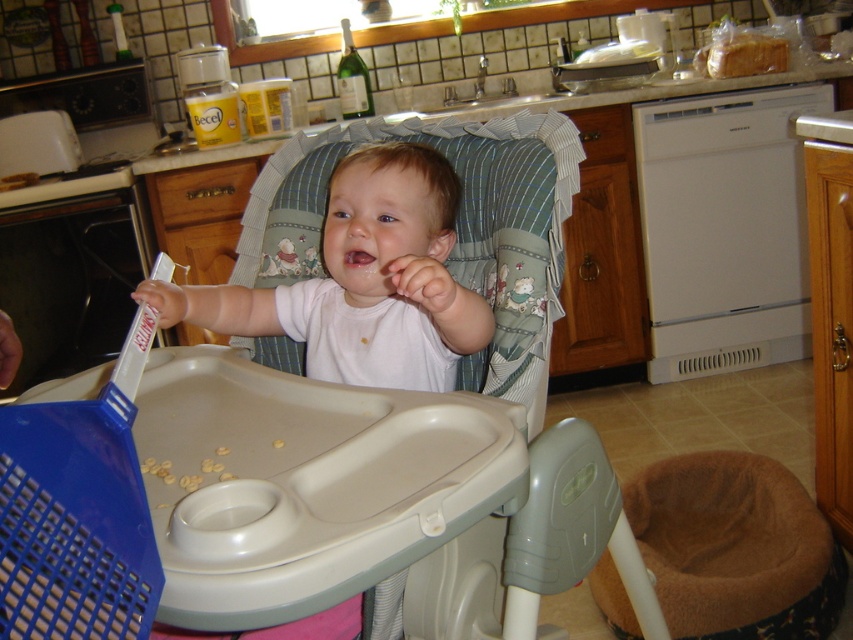
You are a parent trying to ensure your baby is visible in a photo. You have the white matte baby at center and the pink glossy lips at center in the frame. Which object should you focus on to make sure the baby is clearly visible?

You should focus on the white matte baby at center because it is in front of the pink glossy lips at center, making it the more prominent subject in the frame.

You are a caregiver in the kitchen and need to place a pacifier near the white matte baby at center. According to the image, where should you place it to ensure it is within the baby

The white matte baby at center is located at point (403,241), so you should place the pacifier near those coordinates to ensure it is within the baby